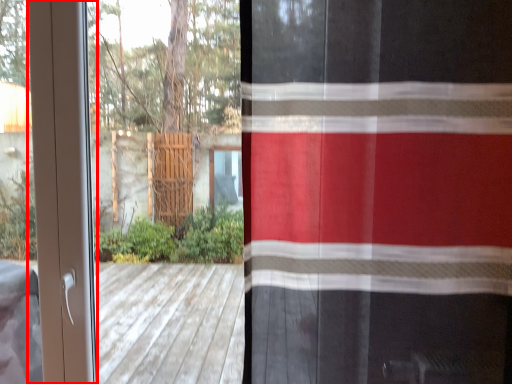
Question: In this image, where is screen door (annotated by the red box) located relative to curtain?

Choices:
 (A) right
 (B) left

Answer: (B)